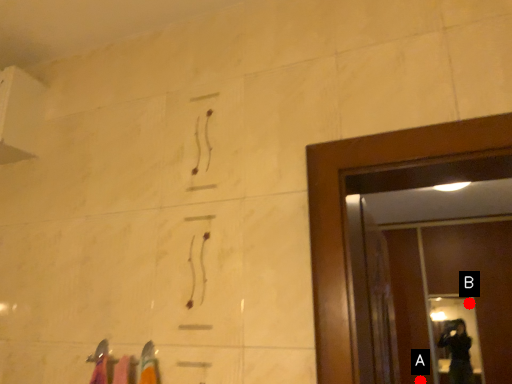
Question: Two points are circled on the image, labeled by A and B beside each circle. Which point is farther from the camera taking this photo?

Choices:
 (A) A is further
 (B) B is further

Answer: (B)